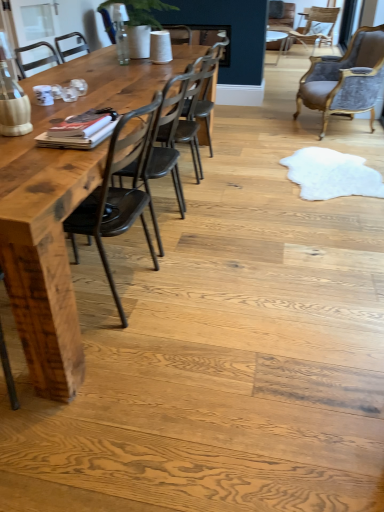
Question: From the image's perspective, is velvet upholstered chair at upper right, which is the 1th chair in right-to-left order, above or below wooden table at left?

Choices:
 (A) above
 (B) below

Answer: (A)

Question: Is velvet upholstered chair at upper right, which is the 1th chair in right-to-left order, spatially inside wooden table at left, or outside of it?

Choices:
 (A) outside
 (B) inside

Answer: (A)

Question: Which of these objects is positioned farthest from the velvet upholstered chair at upper right, which is counted as the 1th chair, starting from the back?

Choices:
 (A) dark brown wood chair at center, the first chair when ordered from front to back
 (B) metallic dark brown chair at center, the third chair in the top-to-bottom sequence
 (C) wooden table at left
 (D) velvet grey chair at upper right, the third chair when ordered from front to back

Answer: (A)

Question: Which of these objects is positioned farthest from the velvet grey chair at upper right, arranged as the third chair when ordered from the bottom?

Choices:
 (A) dark brown wood chair at center, the first chair when ordered from front to back
 (B) wooden table at left
 (C) velvet upholstered chair at upper right, which is counted as the 1th chair, starting from the back
 (D) metallic dark brown chair at center, placed as the third chair when sorted from right to left

Answer: (A)